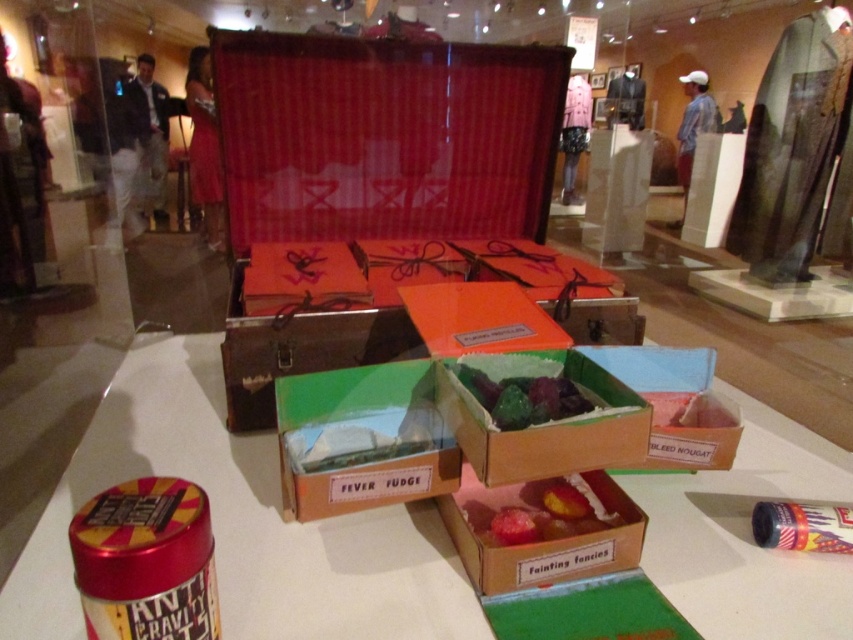
The width and height of the screenshot is (853, 640). Identify the location of cardboard box with colorful candies at center. (543, 532).

From the picture: Which of these two, cardboard box with colorful candies at center or cardboard box at center, stands taller?

cardboard box at center is taller.

Does point (628, 508) come farther from viewer compared to point (701, 372)?

No, it is in front of (701, 372).

I want to click on cardboard box with colorful candies at center, so click(543, 532).

Is brown cardboard boxes at center wider than shiny pink candy at center?

Yes, brown cardboard boxes at center is wider than shiny pink candy at center.

Who is more forward, (73, 595) or (560, 516)?

Point (73, 595)

Where is `brown cardboard boxes at center`? The height and width of the screenshot is (640, 853). brown cardboard boxes at center is located at coordinates (241, 524).

Locate an element on the screen. This screenshot has height=640, width=853. brown cardboard boxes at center is located at coordinates (x=241, y=524).

The image size is (853, 640). Describe the element at coordinates (241, 524) in the screenshot. I see `brown cardboard boxes at center` at that location.

Identify the location of brown cardboard boxes at center. (241, 524).